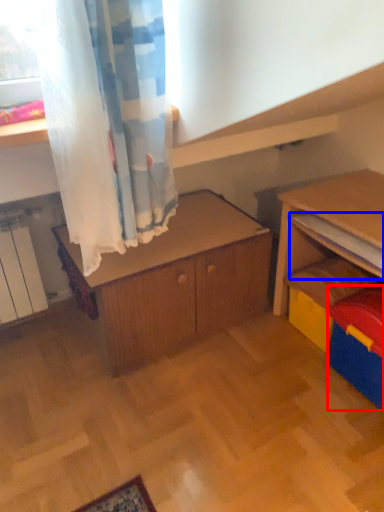
Question: Which of the following is the farthest to the observer, storage box (highlighted by a red box) or shelf (highlighted by a blue box)?

Choices:
 (A) storage box
 (B) shelf

Answer: (B)